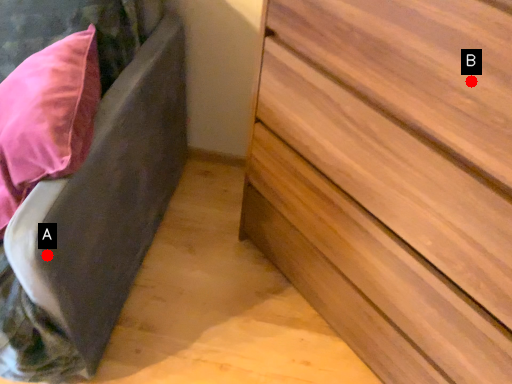
Question: Two points are circled on the image, labeled by A and B beside each circle. Which point is closer to the camera?

Choices:
 (A) A is closer
 (B) B is closer

Answer: (B)